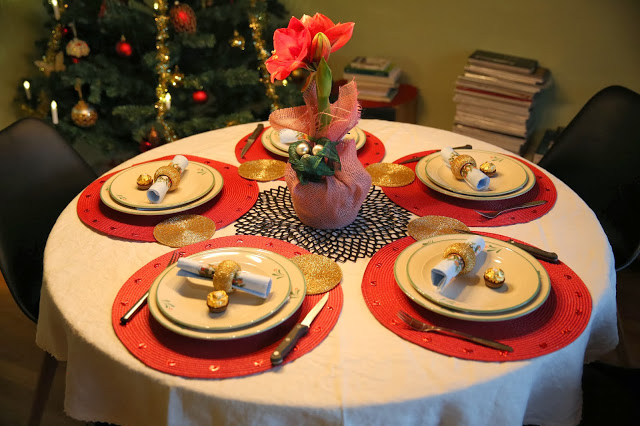
You are a GUI agent. You are given a task and a screenshot of the screen. Output one action in this format:
    pyautogui.click(x=<x>, y=<y>)
    Task: Click on the red round placemats
    
    Given the screenshot: What is the action you would take?
    pyautogui.click(x=196, y=355), pyautogui.click(x=556, y=317), pyautogui.click(x=440, y=204), pyautogui.click(x=369, y=155), pyautogui.click(x=236, y=195)